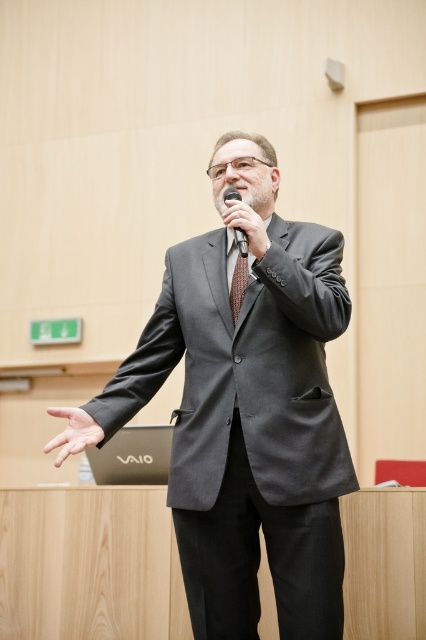
Question: Which object is positioned farthest from the smooth skin hand at center?

Choices:
 (A) brown textured tie at center
 (B) matte gray suit at center

Answer: (A)

Question: Which object is farther from the camera taking this photo?

Choices:
 (A) brown textured tie at center
 (B) matte gray suit at center
 (C) smooth skin hand at center

Answer: (A)

Question: Estimate the real-world distances between objects in this image. Which object is closer to the smooth skin hand at center?

Choices:
 (A) brown textured tie at center
 (B) matte gray suit at center

Answer: (B)

Question: Is matte gray suit at center to the left of brown textured tie at center from the viewer's perspective?

Choices:
 (A) no
 (B) yes

Answer: (B)

Question: Can you confirm if smooth skin hand at center is smaller than brown textured tie at center?

Choices:
 (A) no
 (B) yes

Answer: (A)

Question: Does matte gray suit at center have a lesser width compared to smooth skin hand at center?

Choices:
 (A) no
 (B) yes

Answer: (A)